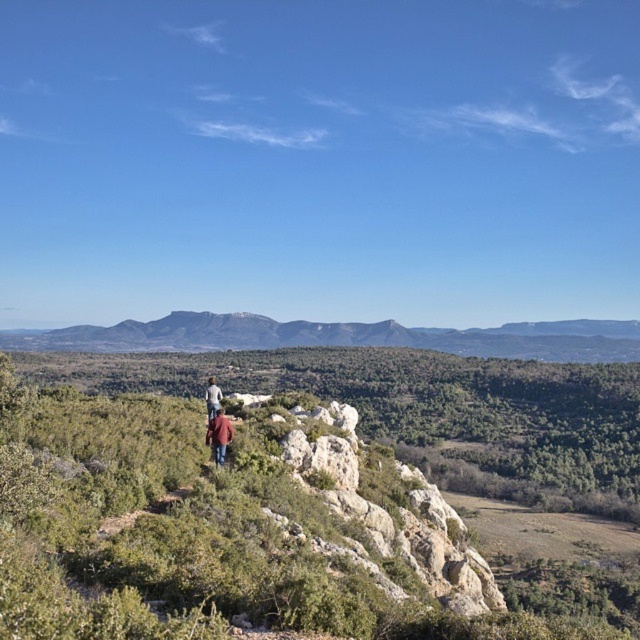
Who is positioned more to the left, brown leather jacket at center or light blue denim jacket at center?

Positioned to the left is light blue denim jacket at center.

Can you confirm if brown leather jacket at center is positioned above light blue denim jacket at center?

Correct, brown leather jacket at center is located above light blue denim jacket at center.

Is point (214, 440) positioned in front of point (212, 384)?

Yes.

Locate an element on the screen. This screenshot has height=640, width=640. brown leather jacket at center is located at coordinates tap(218, 435).

Does green shrubbery at center have a lesser width compared to light blue denim jacket at center?

No, green shrubbery at center is not thinner than light blue denim jacket at center.

Can you confirm if green shrubbery at center is bigger than light blue denim jacket at center?

Correct, green shrubbery at center is larger in size than light blue denim jacket at center.

Who is more forward, (x=381, y=465) or (x=214, y=390)?

Point (x=214, y=390) is more forward.

The image size is (640, 640). I want to click on green shrubbery at center, so click(269, 508).

Is green shrubbery at center thinner than rocky brown mountain at center?

Indeed, green shrubbery at center has a lesser width compared to rocky brown mountain at center.

Who is lower down, green shrubbery at center or rocky brown mountain at center?

green shrubbery at center is below.

Is point (436, 632) behind point (195, 316)?

No.

Find the location of a particular element. green shrubbery at center is located at coordinates (269, 508).